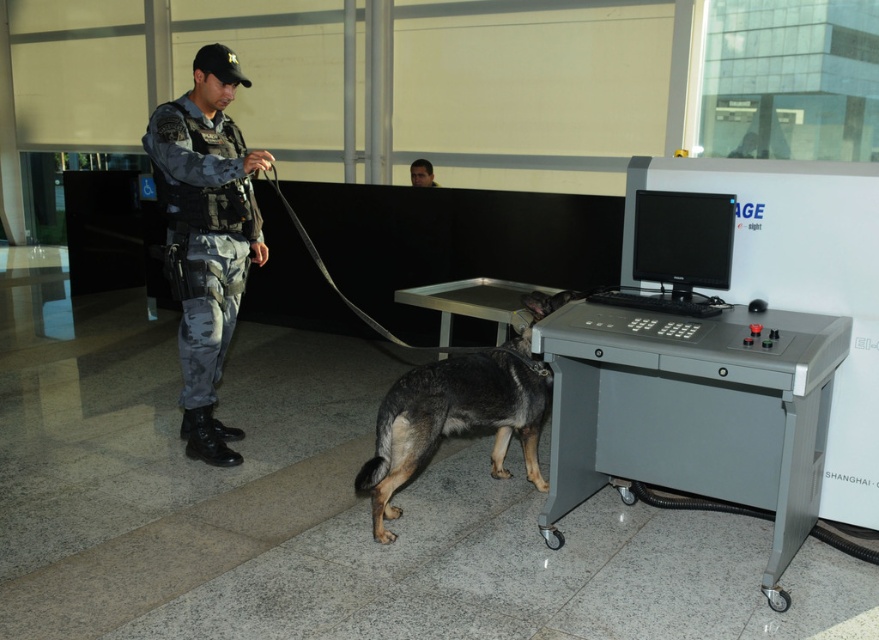
Question: Can you confirm if camouflage uniform at center is wider than dark gray fur dog at center?

Choices:
 (A) no
 (B) yes

Answer: (A)

Question: Which point is farther to the camera?

Choices:
 (A) dark gray fur dog at center
 (B) camouflage uniform at center
 (C) gray metallic control panel at lower right
 (D) smooth skin face at center

Answer: (D)

Question: Which is nearer to the camouflage uniform at center?

Choices:
 (A) smooth skin face at center
 (B) dark gray fur dog at center
 (C) gray metallic control panel at lower right

Answer: (B)

Question: In this image, where is gray metallic control panel at lower right located relative to camouflage uniform at center?

Choices:
 (A) left
 (B) right

Answer: (B)

Question: Which point appears farthest from the camera in this image?

Choices:
 (A) (207, 365)
 (B) (420, 177)
 (C) (489, 364)
 (D) (710, 406)

Answer: (B)

Question: Is dark gray fur dog at center below smooth skin face at center?

Choices:
 (A) yes
 (B) no

Answer: (A)